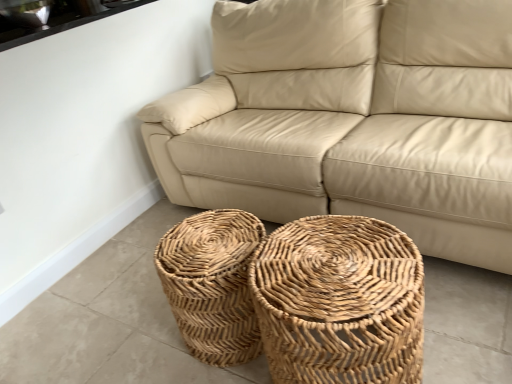
You are a GUI agent. You are given a task and a screenshot of the screen. Output one action in this format:
    pyautogui.click(x=<x>, y=<y>)
    Task: Click on the vacant point to the left of natural woven baskets at center, which is counted as the first basket, starting from the left
    The height and width of the screenshot is (384, 512).
    Given the screenshot: What is the action you would take?
    [x=139, y=338]